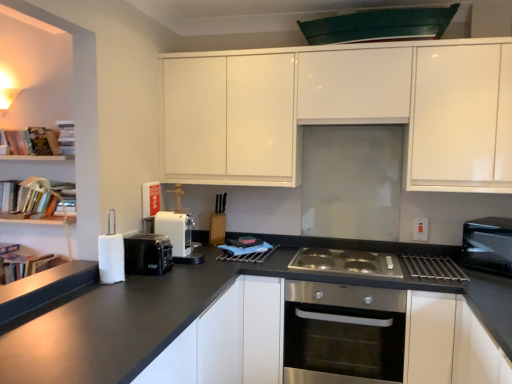
Locate an element on the screen. The width and height of the screenshot is (512, 384). empty space that is ontop of silver metallic gas stove at center (from a real-world perspective) is located at coordinates (348, 262).